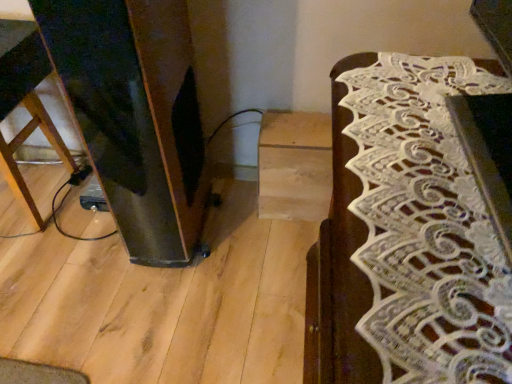
Question: Is wooden stool at left, which is the first furniture in back-to-front order, situated inside white lace table runner at right, arranged as the first furniture when viewed from the front, or outside?

Choices:
 (A) inside
 (B) outside

Answer: (B)

Question: Looking at the image, does wooden stool at left, placed as the first furniture when sorted from left to right, seem bigger or smaller compared to white lace table runner at right, which appears as the 2th furniture when viewed from the back?

Choices:
 (A) big
 (B) small

Answer: (A)

Question: In the image, is wooden stool at left, which is the first furniture in back-to-front order, positioned in front of or behind white lace table runner at right, which appears as the 1th furniture when viewed from the right?

Choices:
 (A) front
 (B) behind

Answer: (B)

Question: From the image's perspective, is white lace table runner at right, arranged as the first furniture when viewed from the front, located above or below wooden stool at left, placed as the first furniture when sorted from left to right?

Choices:
 (A) above
 (B) below

Answer: (B)

Question: Do you think white lace table runner at right, which appears as the second furniture when viewed from the left, is within wooden stool at left, placed as the first furniture when sorted from left to right, or outside of it?

Choices:
 (A) outside
 (B) inside

Answer: (A)

Question: Is point (411, 321) closer or farther from the camera than point (26, 49)?

Choices:
 (A) farther
 (B) closer

Answer: (B)

Question: From a real-world perspective, is white lace table runner at right, which appears as the 2th furniture when viewed from the back, physically located above or below wooden stool at left, placed as the first furniture when sorted from left to right?

Choices:
 (A) below
 (B) above

Answer: (B)